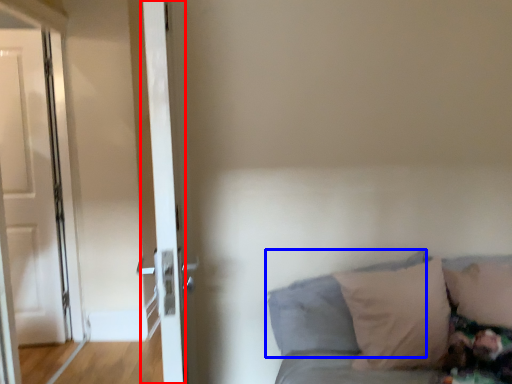
Question: Among these objects, which one is farthest to the camera, door (highlighted by a red box) or pillow (highlighted by a blue box)?

Choices:
 (A) door
 (B) pillow

Answer: (B)